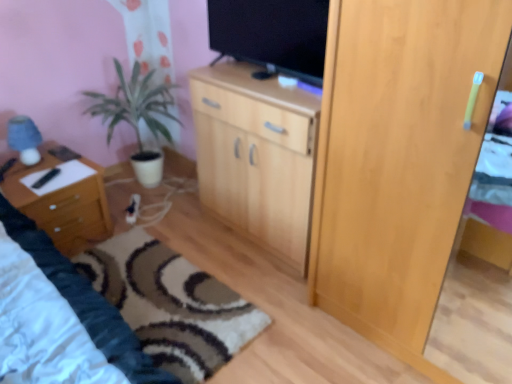
Question: From a real-world perspective, is green matte plant at left above or below wooden nightstand at left?

Choices:
 (A) above
 (B) below

Answer: (A)

Question: In the image, is green matte plant at left positioned in front of or behind wooden nightstand at left?

Choices:
 (A) front
 (B) behind

Answer: (B)

Question: Which object is the closest to the black glossy tv at upper center?

Choices:
 (A) wooden cabinet at center
 (B) wooden nightstand at left
 (C) light wood cupboard at right
 (D) carpet with swirl pattern at lower center
 (E) green matte plant at left

Answer: (A)

Question: Which of these objects is positioned farthest from the light wood cupboard at right?

Choices:
 (A) carpet with swirl pattern at lower center
 (B) black glossy tv at upper center
 (C) wooden nightstand at left
 (D) green matte plant at left
 (E) wooden cabinet at center

Answer: (C)